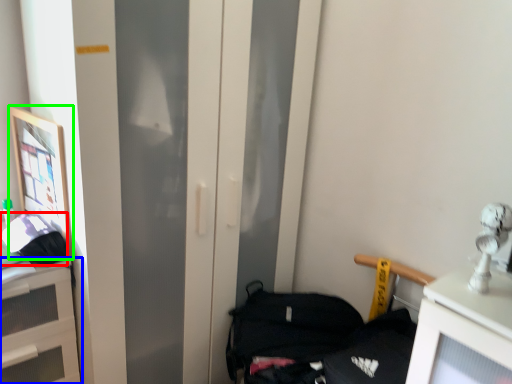
Question: Considering the real-world distances, which object is farthest from handbag (highlighted by a red box)? cabinetry (highlighted by a blue box) or picture frame (highlighted by a green box)?

Choices:
 (A) cabinetry
 (B) picture frame

Answer: (A)